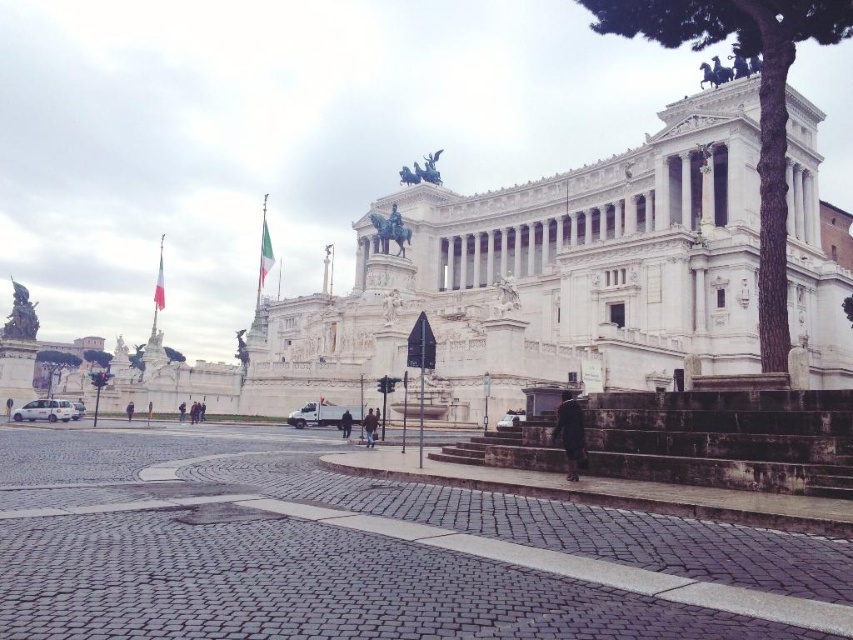
You are standing at the entrance of the grand neoclassical building and want to walk towards the point marked as point (x=515, y=413). However, there is an obstacle at point (x=495, y=449). Will you encounter the obstacle before reaching your destination?

Yes, you will encounter the obstacle at point (x=495, y=449) before reaching your destination at point (x=515, y=413) because point (x=495, y=449) is in front of point (x=515, y=413).

You are a visitor driving a white matte van at center and a metallic silver car at lower center. You want to park both vehicles in the plaza in front of the building. However, there is limited space. Based on their positions, which vehicle should you move first to access the parking spot?

The white matte van at center is positioned under the metallic silver car at lower center. To access the parking spot, you should move the metallic silver car at lower center first since it is above the van and blocking its path.